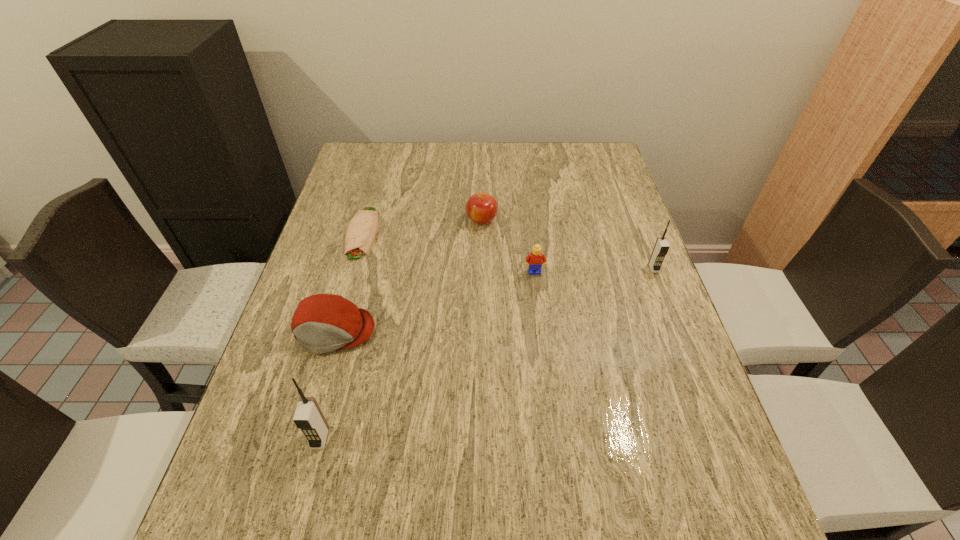
You are a GUI agent. You are given a task and a screenshot of the screen. Output one action in this format:
    pyautogui.click(x=<x>, y=<y>)
    Task: Click on the blank region between the taller cellular telephone and the cap
    The image size is (960, 540).
    Given the screenshot: What is the action you would take?
    pyautogui.click(x=327, y=384)

At what (x,y) coordinates should I click in order to perform the action: click on unoccupied area between the fifth shortest object and the fifth farthest object. Please return your answer as a coordinate pair (x, y). The height and width of the screenshot is (540, 960). Looking at the image, I should click on (494, 299).

Find the location of a particular element. The height and width of the screenshot is (540, 960). empty space that is in between the fifth farthest object and the fourth object from left to right is located at coordinates (408, 275).

Locate an element on the screen. The height and width of the screenshot is (540, 960). unoccupied area between the Lego and the shorter cellular telephone is located at coordinates 594,270.

In order to click on vacant area between the right cellular telephone and the apple in this screenshot , I will do `click(567, 244)`.

Locate which object is the second closest to the cap. Please provide its 2D coordinates. Your answer should be formatted as a tuple, i.e. [(x, y)], where the tuple contains the x and y coordinates of a point satisfying the conditions above.

[(360, 234)]

In order to click on the fourth closest object relative to the third object from right to left in this screenshot , I will do `click(661, 248)`.